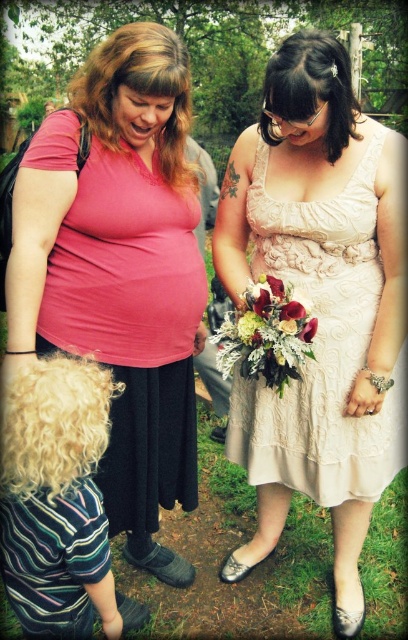
You are a photographer at the event and want to capture a photo that includes both the ivory lace dress at center and the velvety red rose at center. Based on their positions, which object should be placed closer to the front of the frame to ensure both are in focus?

The ivory lace dress at center is taller than the velvety red rose at center, so to ensure both are in focus, the photographer should place the shorter velvety red rose at center closer to the front of the frame. This way, the depth of field will cover both the taller dress and the closer rose effectively.

You are a photographer at this event and want to frame a shot that includes both the ivory lace dress at center and the velvety red rose at center. Based on their positions, which object should you place on the left side of your frame to ensure both are visible?

You should place the velvety red rose at center on the left side of your frame because the ivory lace dress at center is to the right of the velvety red rose at center, so positioning the rose on the left allows the dress to naturally fall to its right within the frame.